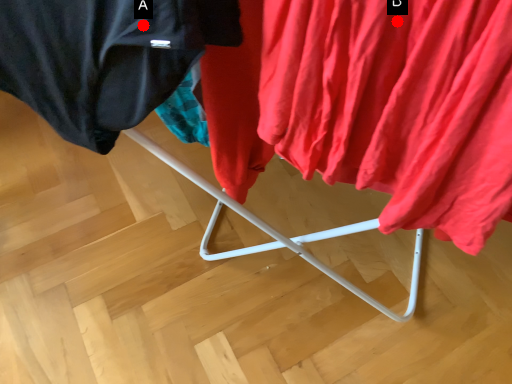
Question: Two points are circled on the image, labeled by A and B beside each circle. Among these points, which one is farthest from the camera?

Choices:
 (A) A is further
 (B) B is further

Answer: (A)